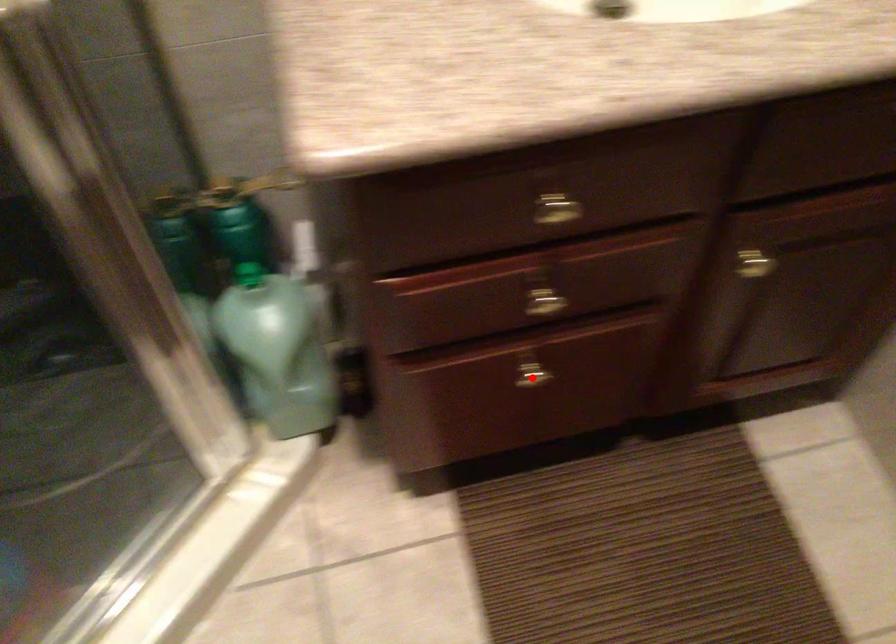
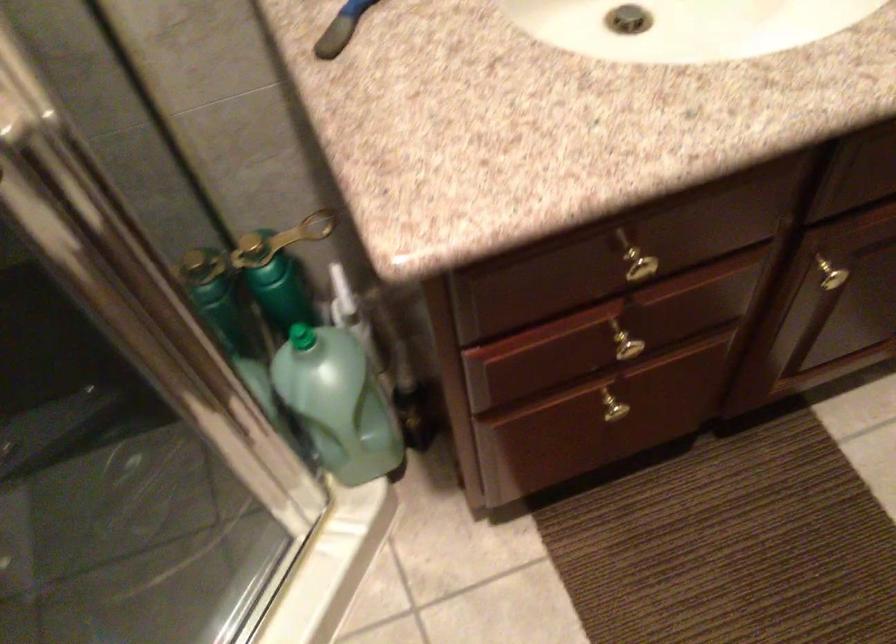
The point at the highlighted location is marked in the first image. Where is the corresponding point in the second image?

(616, 411)